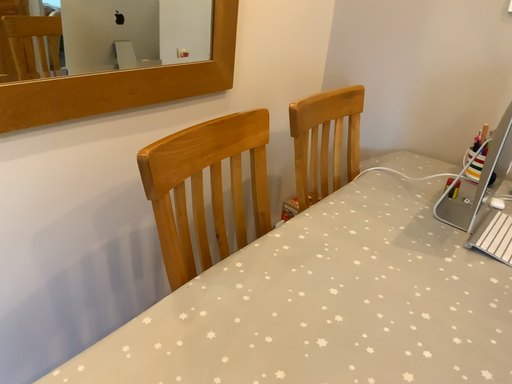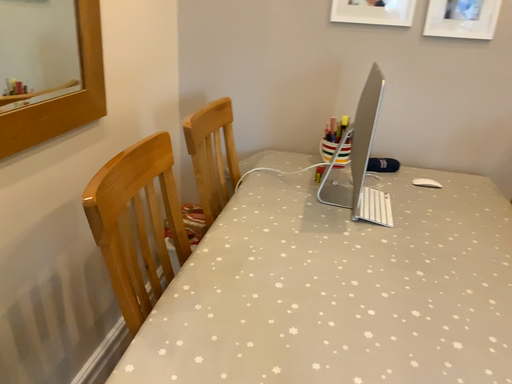
Question: How did the camera likely rotate when shooting the video?

Choices:
 (A) rotated right
 (B) rotated left

Answer: (A)